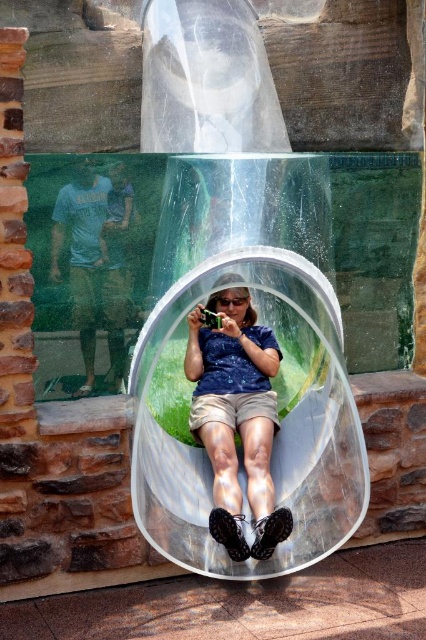
You are a visitor at a zoo and want to take a photo of the transparent plastic bubble at center and the matte blue shirt at center. Which object should you focus on first if you want to capture both in the same frame without moving the camera?

The transparent plastic bubble at center is taller than the matte blue shirt at center, so you should focus on the transparent plastic bubble at center first to ensure both are in frame.